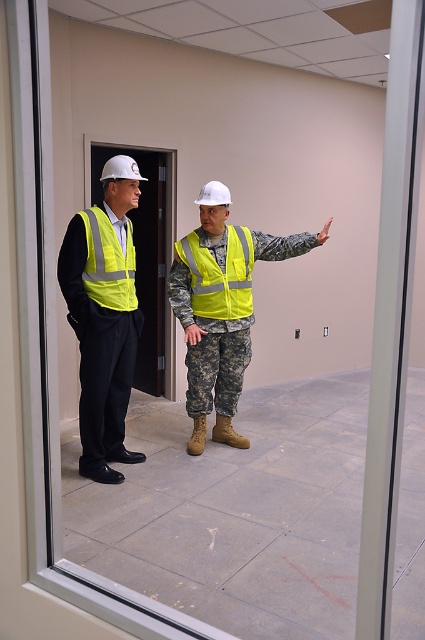
Question: Does matte yellow vest at left come in front of camouflage fabric uniform at center?

Choices:
 (A) yes
 (B) no

Answer: (B)

Question: Is high-visibility fabric safety vest at center below high-visibility fabric safety vest at left?

Choices:
 (A) yes
 (B) no

Answer: (A)

Question: Which of the following is the closest to the observer?

Choices:
 (A) (85, 380)
 (B) (240, 323)
 (C) (243, 273)
 (D) (84, 284)

Answer: (D)

Question: Which object is the closest to the camouflage fabric uniform at center?

Choices:
 (A) high-visibility fabric safety vest at left
 (B) matte yellow vest at left

Answer: (B)

Question: Which object is the closest to the high-visibility fabric safety vest at center?

Choices:
 (A) matte yellow vest at left
 (B) high-visibility fabric safety vest at left
 (C) camouflage fabric uniform at center

Answer: (C)

Question: Can you confirm if camouflage fabric uniform at center is smaller than high-visibility fabric safety vest at left?

Choices:
 (A) no
 (B) yes

Answer: (A)